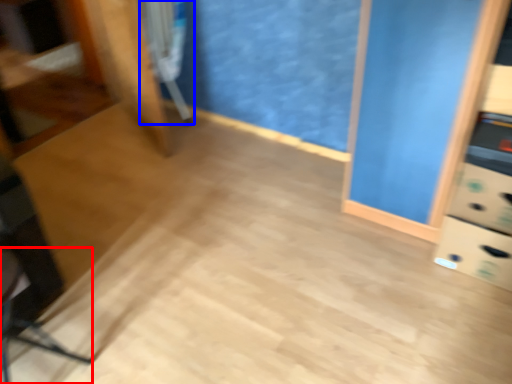
Question: Which object is further to the camera taking this photo, swivel chair (highlighted by a red box) or swivel chair (highlighted by a blue box)?

Choices:
 (A) swivel chair
 (B) swivel chair

Answer: (B)